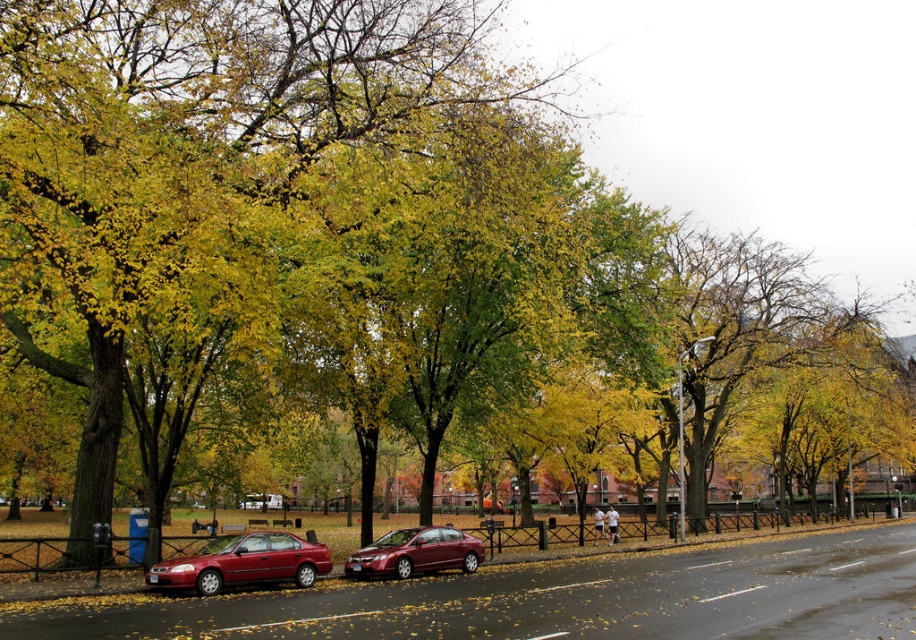
Question: Can you confirm if shiny red sedan at center is positioned below glossy metallic sedan at center?

Choices:
 (A) no
 (B) yes

Answer: (A)

Question: Can you confirm if shiny red sedan at center is positioned below glossy metallic sedan at center?

Choices:
 (A) yes
 (B) no

Answer: (B)

Question: Which point is farther from the camera taking this photo?

Choices:
 (A) (461, 547)
 (B) (222, 566)

Answer: (A)

Question: Is the position of shiny red sedan at center more distant than that of glossy metallic sedan at center?

Choices:
 (A) no
 (B) yes

Answer: (A)

Question: Which point is closer to the camera taking this photo?

Choices:
 (A) (312, 564)
 (B) (416, 536)

Answer: (A)

Question: Which of the following is the farthest from the observer?

Choices:
 (A) tap(241, 579)
 (B) tap(397, 557)

Answer: (B)